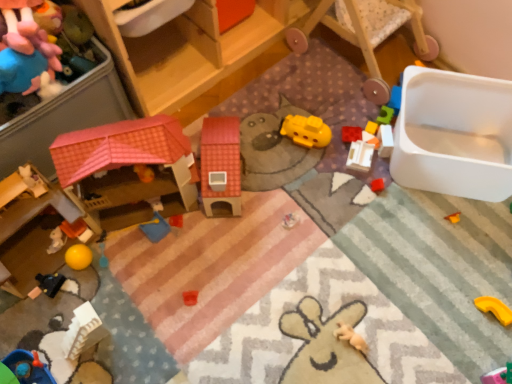
Question: Is wooden rocking chair at upper right in front of or behind light brown plush toy at lower right, which appears as the 6th toy when viewed from the left, in the image?

Choices:
 (A) front
 (B) behind

Answer: (A)

Question: From a real-world perspective, is wooden rocking chair at upper right physically located above or below light brown plush toy at lower right, the sixth toy from the right?

Choices:
 (A) above
 (B) below

Answer: (A)

Question: Based on their relative distances, which object is nearer to the black matte toy car at lower left, arranged as the 2th toy when viewed from the left?

Choices:
 (A) yellow matte block at upper right, positioned as the 3th toy in right-to-left order
 (B) fluffy pink plush at upper left, which is the 11th toy in right-to-left order
 (C) matte plastic dollhouse at center-left, acting as the eighth toy starting from the right
 (D) white plastic building at center-right, the eighth toy when ordered from left to right
 (E) light brown plush toy at lower right, the sixth toy from the right

Answer: (C)

Question: Which object is positioned closest to the white plastic building at center-right, the eighth toy when ordered from left to right?

Choices:
 (A) light brown plush toy at lower right, the sixth toy from the right
 (B) yellow matte submarine at center, which is the 5th toy in left-to-right order
 (C) black matte toy car at lower left, the tenth toy viewed from the right
 (D) rubber brick at upper right, placed as the 7th toy when sorted from left to right
 (E) blue fabric toy at center, acting as the ninth toy starting from the right

Answer: (D)